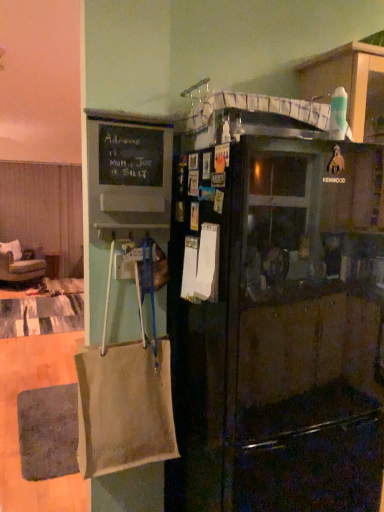
Question: From a real-world perspective, is black chalkboard at upper left physically located above or below green fabric chair at left?

Choices:
 (A) below
 (B) above

Answer: (B)

Question: From the image's perspective, is black chalkboard at upper left positioned above or below green fabric chair at left?

Choices:
 (A) above
 (B) below

Answer: (A)

Question: Considering the real-world distances, which object is farthest from the beige canvas bag at left?

Choices:
 (A) green fabric chair at left
 (B) beige fabric curtain at left
 (C) black matte refrigerator at center
 (D) black chalkboard at upper left

Answer: (B)

Question: Based on their relative distances, which object is nearer to the beige canvas bag at left?

Choices:
 (A) green fabric chair at left
 (B) black matte refrigerator at center
 (C) beige fabric curtain at left
 (D) black chalkboard at upper left

Answer: (B)